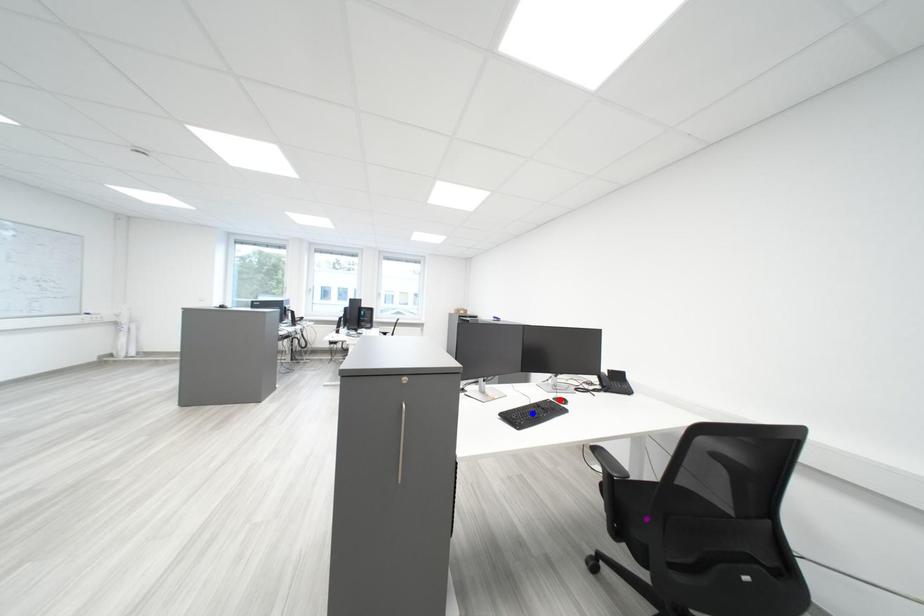
Order these from nearest to farthest:
1. blue point
2. red point
3. purple point

purple point
blue point
red point